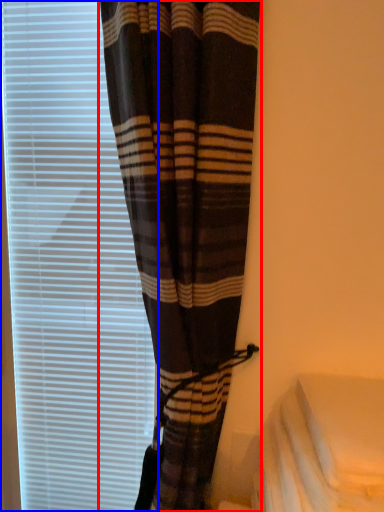
Question: Which of the following is the closest to the observer, curtain (highlighted by a red box) or window blind (highlighted by a blue box)?

Choices:
 (A) curtain
 (B) window blind

Answer: (A)